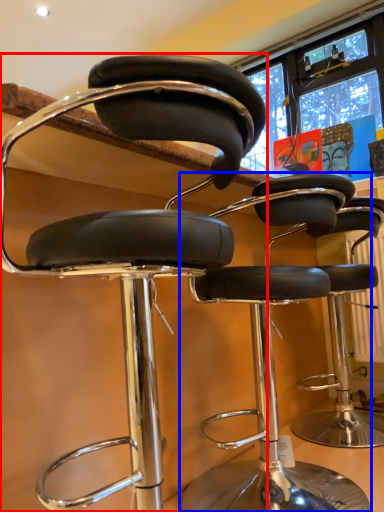
Question: Which object is closer to the camera taking this photo, chair (highlighted by a red box) or chair (highlighted by a blue box)?

Choices:
 (A) chair
 (B) chair

Answer: (A)